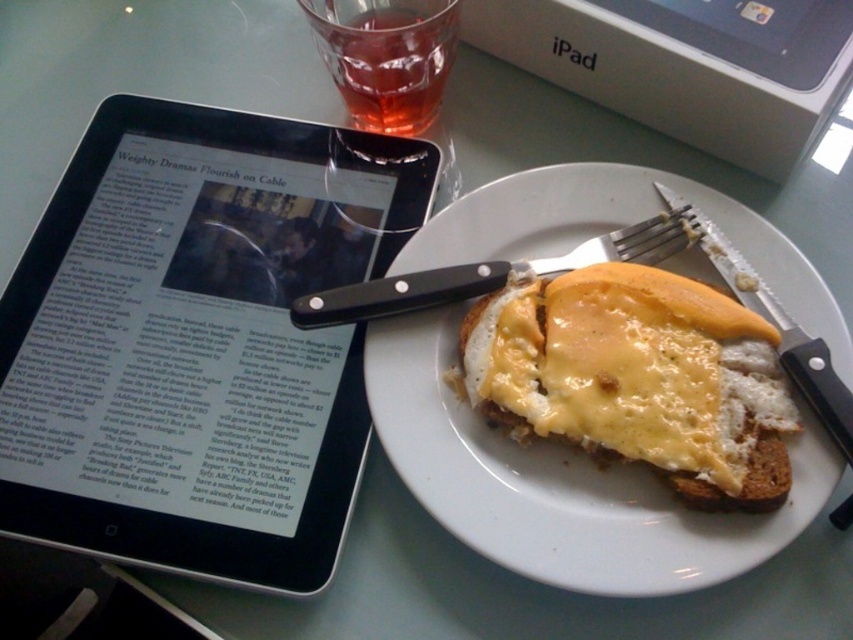
Question: Is black glossy tablet at upper left wider than black plastic fork at upper right?

Choices:
 (A) no
 (B) yes

Answer: (B)

Question: Among these points, which one is nearest to the camera?

Choices:
 (A) (216, 204)
 (B) (642, 221)
 (C) (607, 362)

Answer: (C)

Question: Which point is closer to the camera?

Choices:
 (A) (173, 365)
 (B) (621, 252)
 (C) (554, 384)

Answer: (C)

Question: From the image, what is the correct spatial relationship of slightly toasted bread with melted cheese at center in relation to translucent glass at upper center?

Choices:
 (A) above
 (B) below

Answer: (B)

Question: Is black glossy tablet at upper left further to camera compared to black plastic fork at upper right?

Choices:
 (A) yes
 (B) no

Answer: (B)

Question: Which point is closer to the camera taking this photo?

Choices:
 (A) (646, 212)
 (B) (589, 244)

Answer: (B)